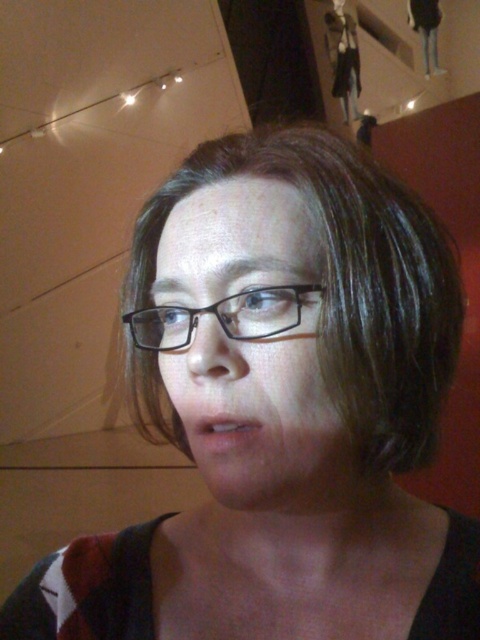
You are taking a photo of the person in the gallery. You need to focus on two points in the image, point 1 at (272, 432) and point 2 at (143, 312). Which point should you focus on first if you want to ensure the person is sharp in the photo?

You should focus on point 1 at (272, 432) first because it is closer to the camera than point 2 at (143, 312). Focusing on the closer point ensures the person is sharp.

You are a photographer trying to capture both the matte black glasses at center and the black plastic glasses at center in a single frame. Given that your camera can only focus on objects within a 10 cm width, can you fit both glasses into the frame without overlapping?

The matte black glasses at center is wider than the black plastic glasses at center. Since the camera can only focus on objects within a 10 cm width, you need to check if their combined width exceeds this limit. However, the exact widths are not provided, so it is uncertain if they can fit without overlapping.